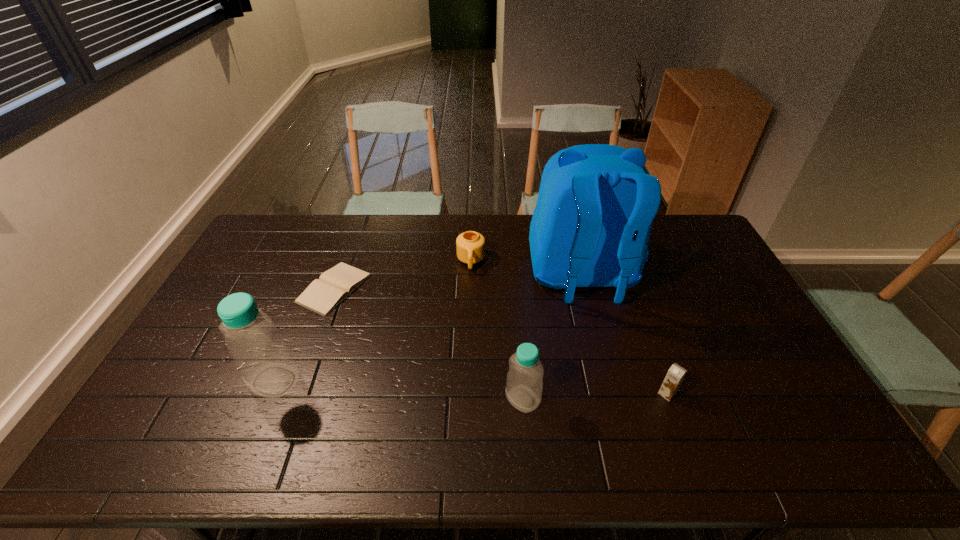
Where is `vacant point located between the right bottle and the third object from left to right`? This screenshot has width=960, height=540. vacant point located between the right bottle and the third object from left to right is located at coordinates (496, 330).

I want to click on free spot between the Bible and the tallest object, so click(458, 282).

The width and height of the screenshot is (960, 540). I want to click on the second closest object to the fourth object from right to left, so click(x=324, y=294).

Locate an element on the screen. The width and height of the screenshot is (960, 540). object that is the third closest to the Bible is located at coordinates (524, 384).

The width and height of the screenshot is (960, 540). What are the coordinates of `vacant space that satisfies the following two spatial constraints: 1. on the handle side of the chocolate milk; 2. on the right side of the fourth object from right to left` in the screenshot? It's located at (468, 394).

Identify the location of free location that satisfies the following two spatial constraints: 1. on the back of the chocolate milk; 2. on the left side of the tallest object. The width and height of the screenshot is (960, 540). (612, 394).